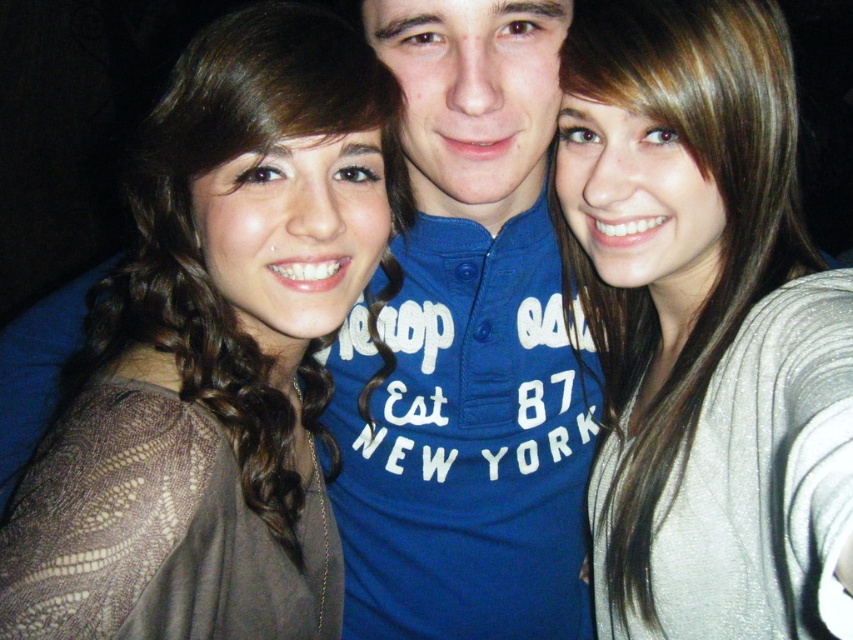
Question: Is satin silver sweater at center wider than brown lace top at left?

Choices:
 (A) yes
 (B) no

Answer: (B)

Question: Considering the relative positions of blue cotton shirt at center and brown lace top at left in the image provided, where is blue cotton shirt at center located with respect to brown lace top at left?

Choices:
 (A) below
 (B) above

Answer: (A)

Question: Which point is farther to the camera?

Choices:
 (A) blue cotton shirt at center
 (B) satin silver sweater at center

Answer: (A)

Question: Which of these objects is positioned closest to the brown lace top at left?

Choices:
 (A) satin silver sweater at center
 (B) blue cotton shirt at center

Answer: (B)

Question: Which of the following is the farthest from the observer?

Choices:
 (A) (619, 385)
 (B) (164, 195)

Answer: (A)

Question: Does satin silver sweater at center appear on the left side of blue cotton shirt at center?

Choices:
 (A) yes
 (B) no

Answer: (B)